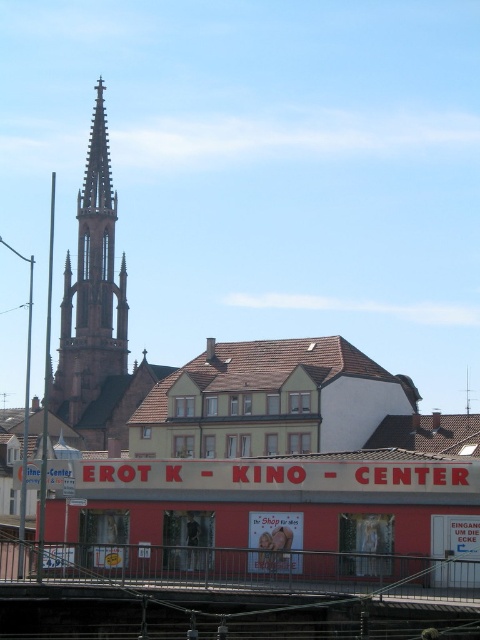
You are standing in the urban scene and want to determine the relative positions of two points marked in the image. Which of the two points, point 1 at coordinates point (91,408) or point 2 at coordinates point (288,566), is closer to you?

Point 1 at coordinates point (91,408) is closer to you because it is further to the camera than point 2 at coordinates point (288,566).